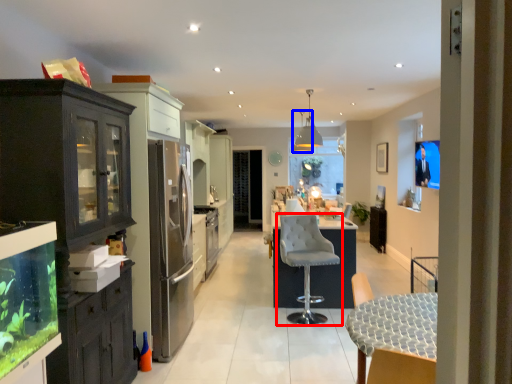
Question: Which of the following is the farthest to the observer, chair (highlighted by a red box) or lamp (highlighted by a blue box)?

Choices:
 (A) chair
 (B) lamp

Answer: (B)